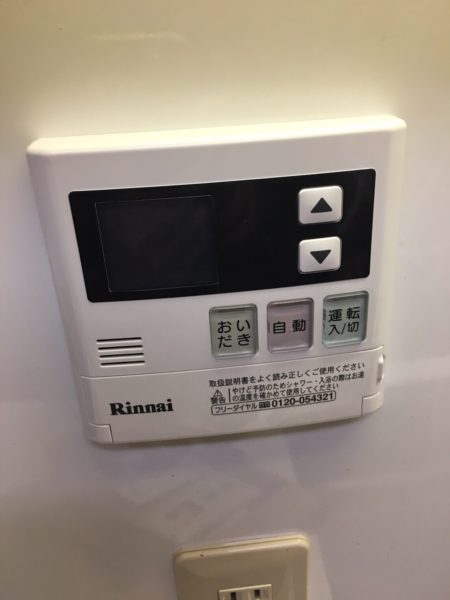
This screenshot has width=450, height=600. I want to click on wall, so click(255, 482).